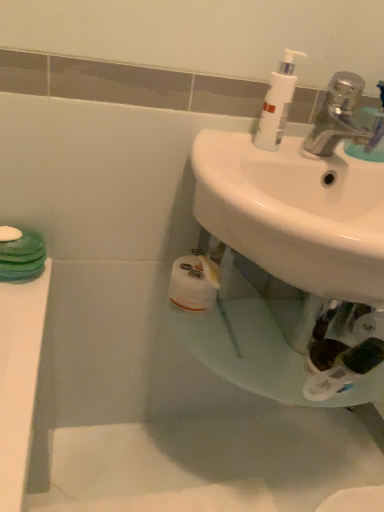
Where is `unoccupied area in front of white plastic pump bottle at upper right`? unoccupied area in front of white plastic pump bottle at upper right is located at coordinates (238, 162).